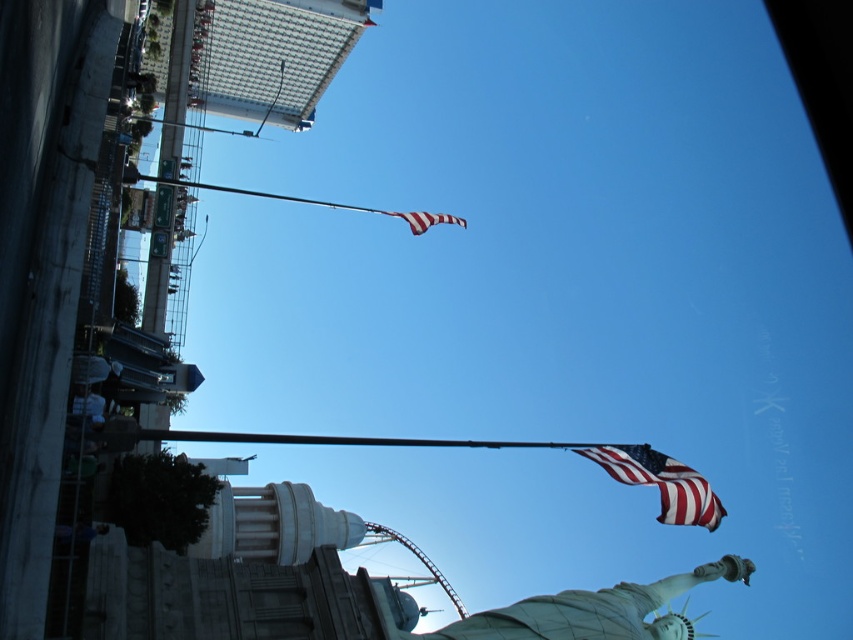
You are standing at the center of the Statue of Liberty observation deck. You want to take a photo of the polished metal flag pole at upper center. Which direction should you face to ensure the flag pole is in the center of your photo?

The polished metal flag pole at upper center is located at point (314, 202), so you should face towards the upper center direction to center it in your photo.

You are a tourist standing in front of the Statue of Liberty and looking at the polished metal flag pole at upper center and the american flag at upper center. Which object is higher in the image?

The polished metal flag pole at upper center is above the american flag at upper center in the image.

You are a tourist visiting the Statue of Liberty. You want to take a photo that includes both the shiny silver statue at lower center and the american flag at upper center. Which object should you focus on first to ensure both are in frame?

You should focus on the shiny silver statue at lower center first because it is larger than the american flag at upper center, so you need to ensure it fits properly before adjusting for the smaller flag.